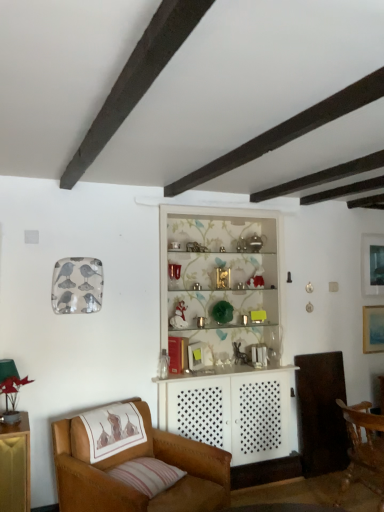
Question: Can you confirm if wooden chair at lower right, which appears as the 2th chair when viewed from the left, is thinner than matte black picture frame at upper right, which is the 2th picture frame in bottom-to-top order?

Choices:
 (A) no
 (B) yes

Answer: (A)

Question: From the image's perspective, does wooden chair at lower right, which appears as the 2th chair when viewed from the left, appear lower than matte black picture frame at upper right, which is the 2th picture frame in bottom-to-top order?

Choices:
 (A) no
 (B) yes

Answer: (B)

Question: From a real-world perspective, is wooden chair at lower right, which is the 1th chair from right to left, located beneath matte black picture frame at upper right, arranged as the 1th picture frame when viewed from the top?

Choices:
 (A) yes
 (B) no

Answer: (A)

Question: Can we say wooden chair at lower right, which appears as the 2th chair when viewed from the left, lies outside matte black picture frame at upper right, which is the 2th picture frame in bottom-to-top order?

Choices:
 (A) yes
 (B) no

Answer: (A)

Question: Can you confirm if wooden chair at lower right, which appears as the 2th chair when viewed from the left, is bigger than matte black picture frame at upper right, arranged as the 1th picture frame when viewed from the top?

Choices:
 (A) yes
 (B) no

Answer: (A)

Question: Is the surface of wooden chair at lower right, which is the 1th chair from right to left, in direct contact with matte black picture frame at upper right, which is the 2th picture frame in bottom-to-top order?

Choices:
 (A) yes
 (B) no

Answer: (B)

Question: Does matte blue painting at upper right, the first picture frame positioned from the bottom, appear on the left side of matte black picture frame at upper right, which is the 2th picture frame in bottom-to-top order?

Choices:
 (A) yes
 (B) no

Answer: (A)

Question: From a real-world perspective, does matte blue painting at upper right, the first picture frame positioned from the bottom, stand above matte black picture frame at upper right, arranged as the 1th picture frame when viewed from the top?

Choices:
 (A) yes
 (B) no

Answer: (B)

Question: From the image's perspective, is matte blue painting at upper right, the 2th picture frame when ordered from top to bottom, beneath matte black picture frame at upper right, which is the 2th picture frame in bottom-to-top order?

Choices:
 (A) yes
 (B) no

Answer: (A)

Question: Does matte blue painting at upper right, the 2th picture frame when ordered from top to bottom, turn towards matte black picture frame at upper right, arranged as the 1th picture frame when viewed from the top?

Choices:
 (A) no
 (B) yes

Answer: (A)

Question: Can you confirm if matte blue painting at upper right, the first picture frame positioned from the bottom, is thinner than matte black picture frame at upper right, arranged as the 1th picture frame when viewed from the top?

Choices:
 (A) no
 (B) yes

Answer: (A)

Question: Is matte blue painting at upper right, the 2th picture frame when ordered from top to bottom, closer to camera compared to matte black picture frame at upper right, arranged as the 1th picture frame when viewed from the top?

Choices:
 (A) yes
 (B) no

Answer: (A)

Question: Does wooden chair at lower right, which appears as the 2th chair when viewed from the left, appear on the right side of leather armchair at lower left, the 1th chair viewed from the left?

Choices:
 (A) yes
 (B) no

Answer: (A)